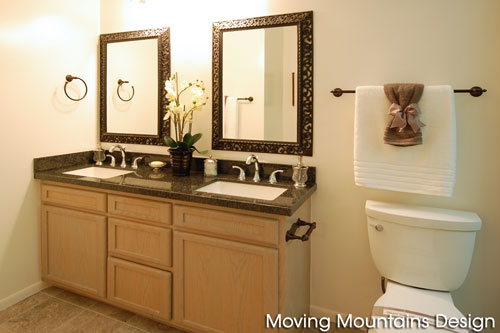
The height and width of the screenshot is (333, 500). In order to click on towel rack in this screenshot , I will do `click(339, 87)`.